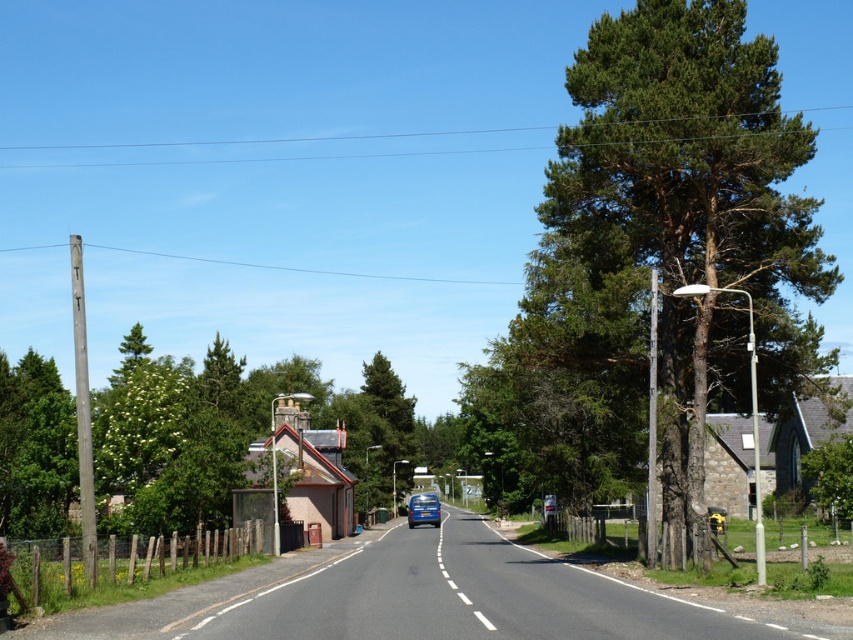
Question: Is green leafy tree at left positioned before blue metallic van at center?

Choices:
 (A) yes
 (B) no

Answer: (A)

Question: Is green textured tree at center to the left of blue metallic van at center from the viewer's perspective?

Choices:
 (A) no
 (B) yes

Answer: (B)

Question: Which object is the farthest from the green leafy tree at left?

Choices:
 (A) blue metallic van at center
 (B) green textured tree at right

Answer: (A)

Question: Can you confirm if green textured tree at center is thinner than green leafy tree at center-right?

Choices:
 (A) no
 (B) yes

Answer: (B)

Question: Which point is farther from the camera taking this photo?

Choices:
 (A) (672, 241)
 (B) (380, 360)

Answer: (B)

Question: Estimate the real-world distances between objects in this image. Which object is farther from the green leafy tree at center-right?

Choices:
 (A) green textured tree at right
 (B) green textured tree at center
 (C) blue metallic van at center
 (D) green leafy tree at left

Answer: (B)